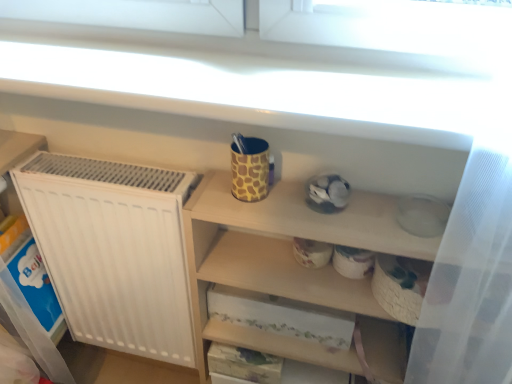
Question: From a real-world perspective, is giraffe-patterned ceramic mug at upper center positioned above or below wooden shelf at upper center?

Choices:
 (A) below
 (B) above

Answer: (B)

Question: Considering the positions of giraffe-patterned ceramic mug at upper center and wooden shelf at upper center in the image, is giraffe-patterned ceramic mug at upper center bigger or smaller than wooden shelf at upper center?

Choices:
 (A) small
 (B) big

Answer: (A)

Question: From the image's perspective, is giraffe-patterned ceramic mug at upper center above or below wooden shelf at upper center?

Choices:
 (A) below
 (B) above

Answer: (B)

Question: Would you say wooden shelf at upper center is to the left or to the right of giraffe-patterned ceramic mug at upper center in the picture?

Choices:
 (A) left
 (B) right

Answer: (B)

Question: Which is correct: wooden shelf at upper center is inside giraffe-patterned ceramic mug at upper center, or outside of it?

Choices:
 (A) outside
 (B) inside

Answer: (A)

Question: Looking at the image, does wooden shelf at upper center seem bigger or smaller compared to giraffe-patterned ceramic mug at upper center?

Choices:
 (A) small
 (B) big

Answer: (B)

Question: Relative to giraffe-patterned ceramic mug at upper center, is wooden shelf at upper center in front or behind?

Choices:
 (A) behind
 (B) front

Answer: (B)